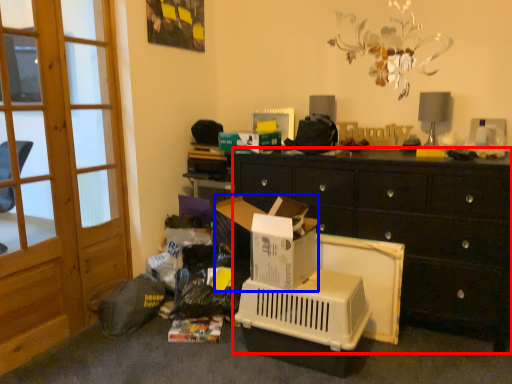
Question: Among these objects, which one is farthest to the camera, cabinetry (highlighted by a red box) or cardboard box (highlighted by a blue box)?

Choices:
 (A) cabinetry
 (B) cardboard box

Answer: (B)